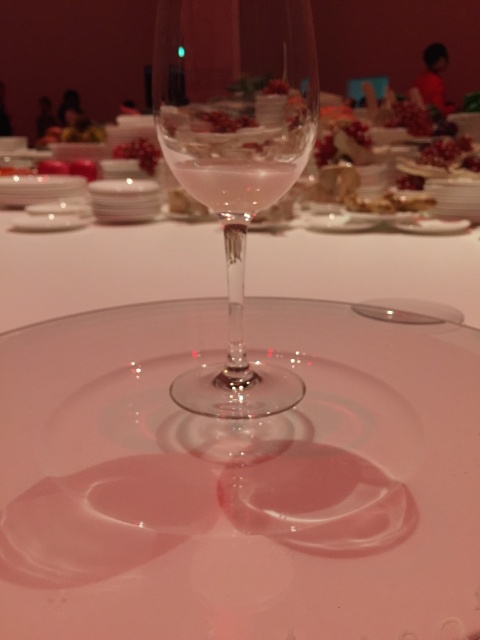
You are standing at the edge of the reflective surface where the wine glass is placed. You want to reach both the point at coordinates point (437, 150) and point (199, 115). Which point should you reach for first?

You should reach for point (437, 150) first because it is closer to you than point (199, 115), which is further away.

You are a guest at a formal dinner and notice both the clear glass wine at center and the pomegranate seeds at center on the table. Which item is positioned higher relative to the other?

The pomegranate seeds at center are positioned higher than the clear glass wine at center.

You are a bartender preparing drinks and notice the transparent glass at center and the clear glass wine at center. Which item is positioned lower in the image?

The transparent glass at center is positioned lower than the clear glass wine at center in the image.